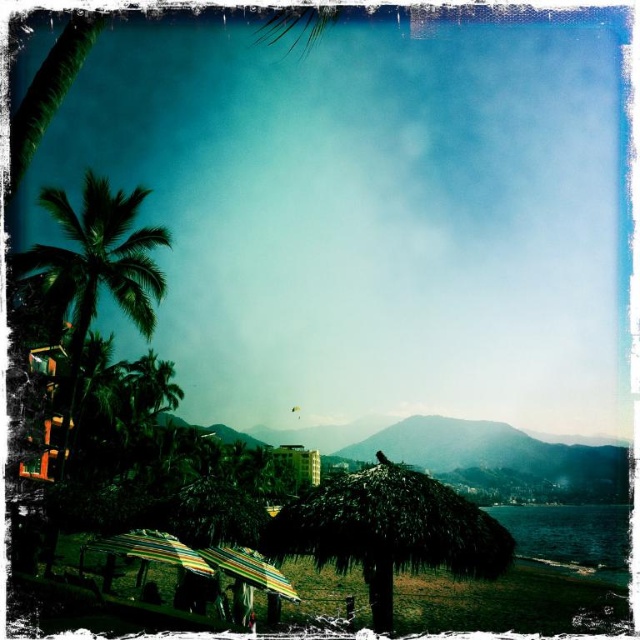
Which is more to the right, green leafy palm tree at left or rainbow striped fabric umbrella at lower left?

rainbow striped fabric umbrella at lower left

Is green leafy palm tree at left above rainbow striped fabric umbrella at lower left?

Yes.

The width and height of the screenshot is (640, 640). Describe the element at coordinates (96, 273) in the screenshot. I see `green leafy palm tree at left` at that location.

Locate an element on the screen. The image size is (640, 640). green leafy palm tree at left is located at coordinates (96, 273).

Which of these two, green leafy palm tree at left or multicolored striped umbrella at center, stands taller?

green leafy palm tree at left is taller.

Between green leafy palm tree at left and multicolored striped umbrella at center, which one is positioned higher?

Positioned higher is green leafy palm tree at left.

Is point (140, 189) closer to viewer compared to point (285, 584)?

That is False.

Find the location of a particular element. green leafy palm tree at left is located at coordinates (96, 273).

At what (x,y) coordinates should I click in order to perform the action: click on multicolored striped umbrella at center. Please return your answer as a coordinate pair (x, y). Image resolution: width=640 pixels, height=640 pixels. Looking at the image, I should click on (250, 570).